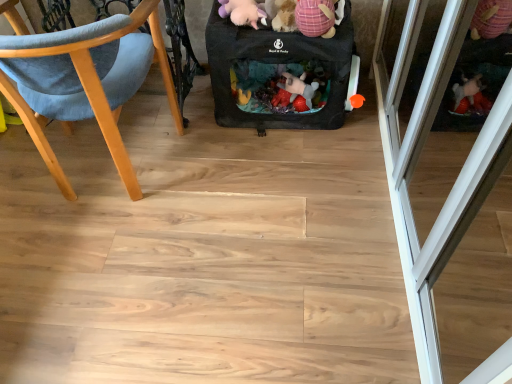
The image size is (512, 384). In order to click on free location to the left of transparent glass screen door at right in this screenshot , I will do `click(251, 235)`.